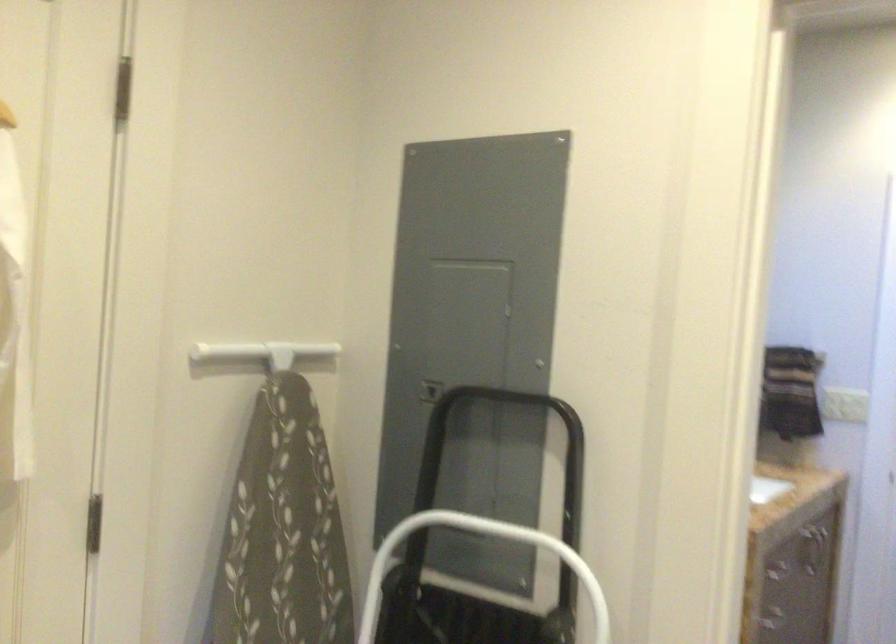
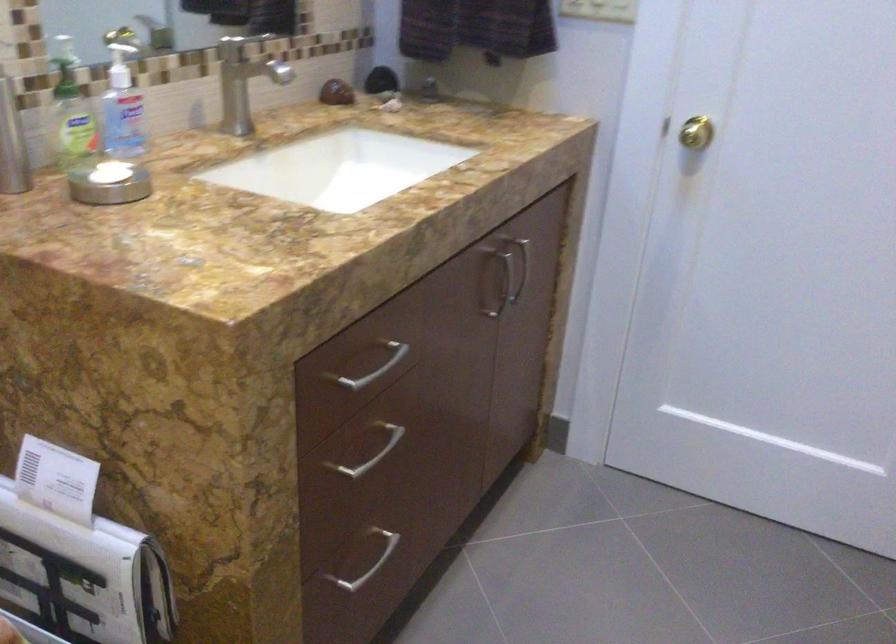
In a continuous first-person perspective shot, in which direction is the camera moving?

The movement direction of the cameraman is right, forward.